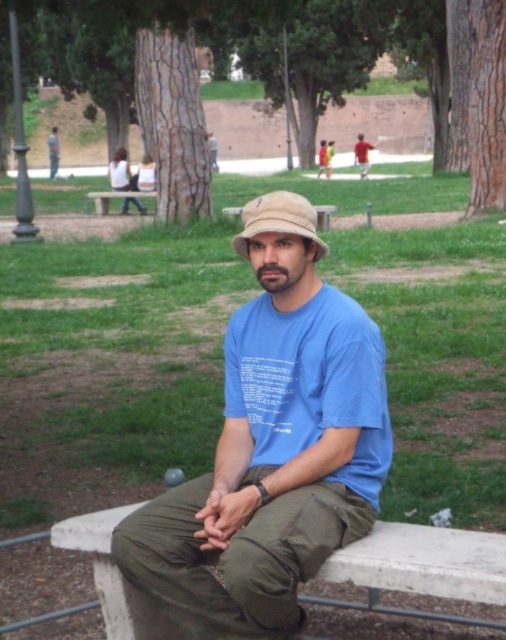
Question: Which of the following is the closest to the observer?

Choices:
 (A) (484, 204)
 (B) (148, 56)

Answer: (A)

Question: Observing the image, what is the correct spatial positioning of brown rough tree at right in reference to matte black shirt at center?

Choices:
 (A) below
 (B) above

Answer: (A)

Question: Considering the real-world distances, which object is closest to the matte red shirt at center?

Choices:
 (A) blue cotton t-shirt at center
 (B) blue cotton shirt at center

Answer: (B)

Question: Does blue cotton shirt at center appear under green bark tree at center?

Choices:
 (A) no
 (B) yes

Answer: (B)

Question: Is blue cotton shirt at center smaller than green bark tree at center?

Choices:
 (A) no
 (B) yes

Answer: (B)

Question: Which point appears closest to the camera in this image?

Choices:
 (A) (159, 65)
 (B) (133, 193)
 (C) (324, 253)

Answer: (C)